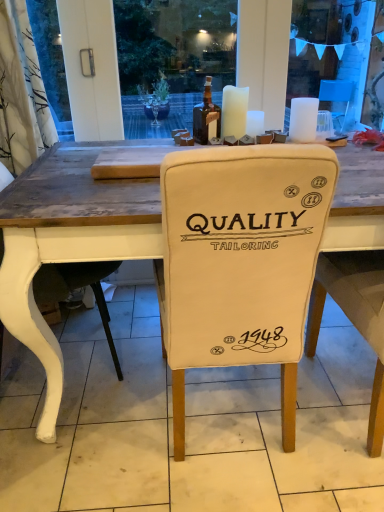
Identify the location of empty space that is ontop of white fabric chair cover at center (from a real-world perspective). (184, 403).